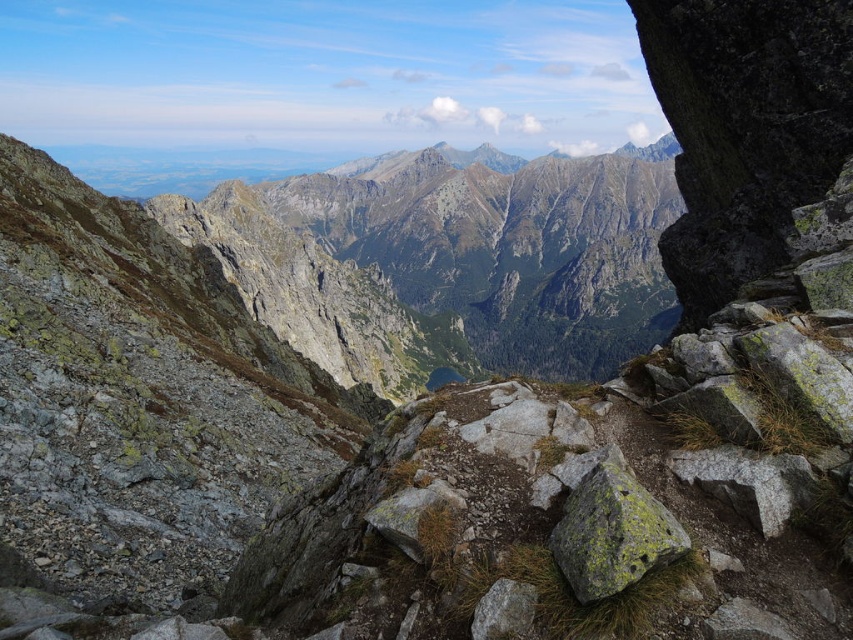
What do you see at coordinates (612, 532) in the screenshot? The width and height of the screenshot is (853, 640). I see `green mossy rock at lower right` at bounding box center [612, 532].

Does point (590, 531) come in front of point (517, 605)?

No, (590, 531) is further to viewer.

You are a GUI agent. You are given a task and a screenshot of the screen. Output one action in this format:
    pyautogui.click(x=<x>, y=<y>)
    Task: Click on the green mossy rock at lower right
    The height and width of the screenshot is (640, 853).
    Given the screenshot: What is the action you would take?
    pyautogui.click(x=612, y=532)